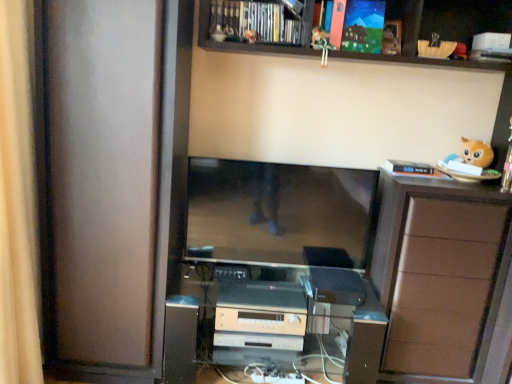
Identify the location of vacant point above beige plastic stereo at lower center, the second appliance viewed from the right (from a real-world perspective). (262, 298).